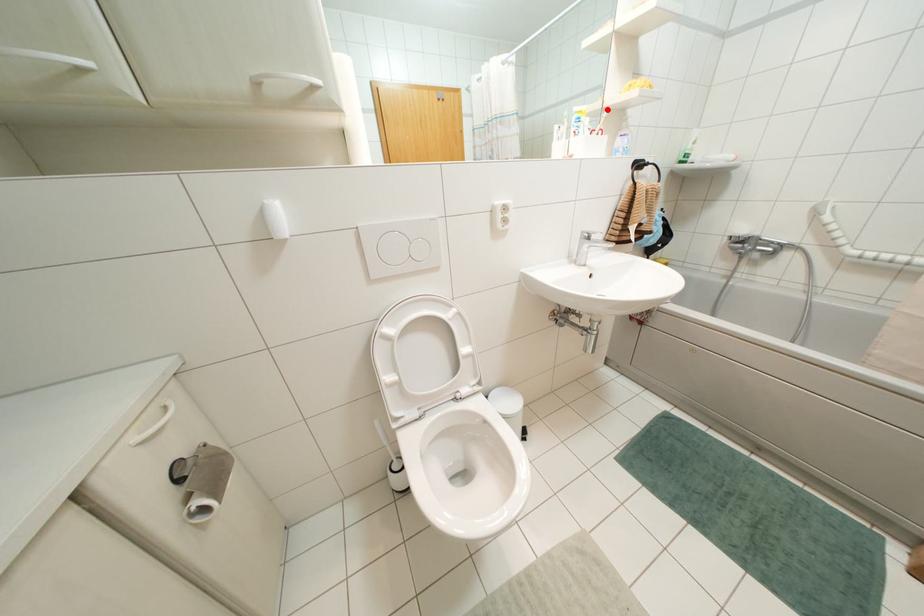
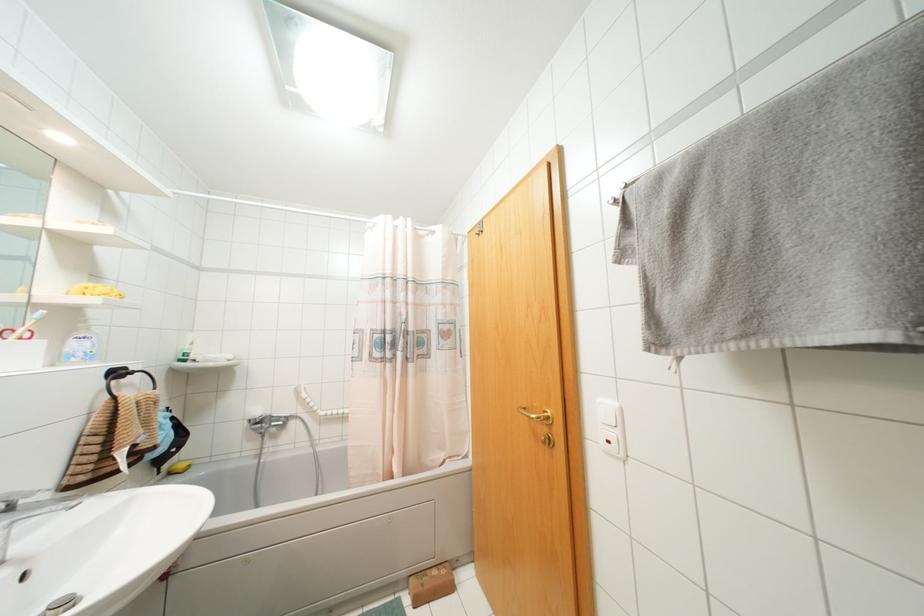
In the second image, find the point that corresponds to the highlighted location in the first image.

(42, 310)